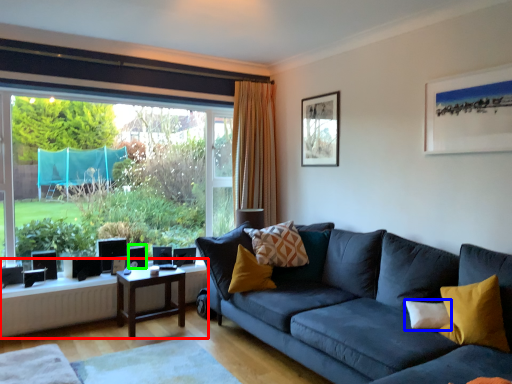
Question: Based on their relative distances, which object is nearer to table (highlighted by a red box)? Choose from pillow (highlighted by a blue box) and speaker (highlighted by a green box).

Choices:
 (A) pillow
 (B) speaker

Answer: (B)